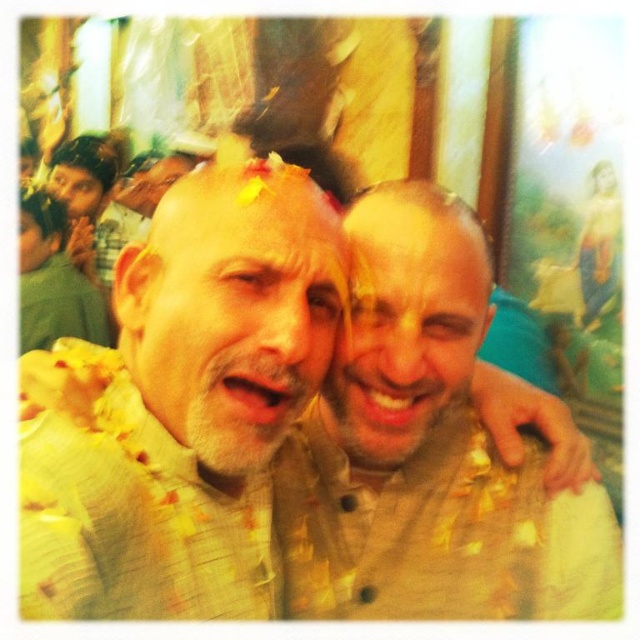
You are a photographer trying to capture a closeup shot of both the smooth beige face at center and the brown matte beard at upper left. Since you want to focus on both, which one should you adjust your camera to prioritize focusing on first?

The smooth beige face at center is taller than the brown matte beard at upper left, so you should prioritize focusing on the smooth beige face at center first because it is larger and will require more precise focus.

You are a photographer trying to capture the main subject in the image. The main subject is the smooth beige face at center represented by point (406, 333). Where should you focus your camera to ensure the main subject is in sharp focus?

You should focus your camera on the point (406, 333) to ensure the smooth beige face at center is in sharp focus.

You are a photographer taking a picture of two people in a temple. You notice the matte beige kurta at center and the smooth beige face at center. Which object is positioned to the left of the other?

The matte beige kurta at center is to the left of smooth beige face at center.